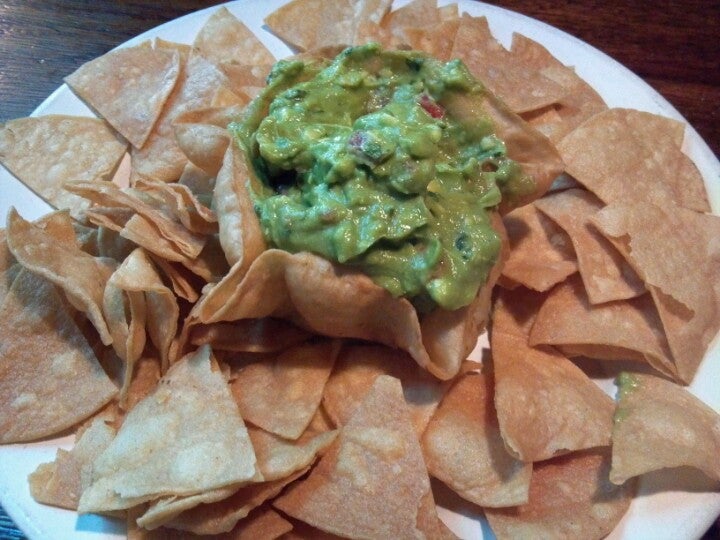
Where is `top right of the table`? This screenshot has width=720, height=540. top right of the table is located at coordinates (670, 69).